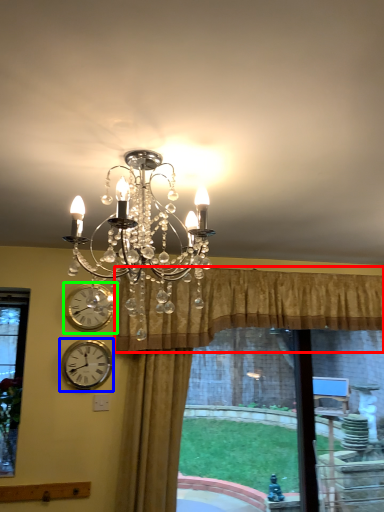
Question: Which object is positioned closest to curtain (highlighted by a red box)? Select from wall clock (highlighted by a blue box) and wall clock (highlighted by a green box).

Choices:
 (A) wall clock
 (B) wall clock

Answer: (A)